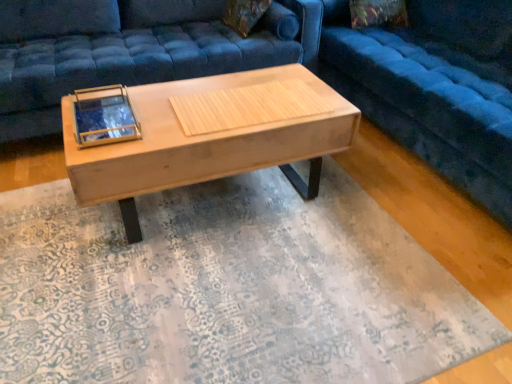
This screenshot has height=384, width=512. Describe the element at coordinates (434, 87) in the screenshot. I see `velvet blue studio couch at center, acting as the 1th studio couch starting from the right` at that location.

How much space does velvet blue studio couch at center, which is the 2th studio couch in left-to-right order, occupy vertically?

velvet blue studio couch at center, which is the 2th studio couch in left-to-right order, is 35.09 inches in height.

At what (x,y) coordinates should I click in order to perform the action: click on velvet blue studio couch at center, arranged as the first studio couch when viewed from the left. Please return your answer as a coordinate pair (x, y). Looking at the image, I should click on (142, 53).

From a real-world perspective, is velvet blue studio couch at center, which is the 2th studio couch in left-to-right order, physically located above or below natural wood coffee table at center?

From a real-world perspective, velvet blue studio couch at center, which is the 2th studio couch in left-to-right order, is physically above natural wood coffee table at center.

There is a natural wood coffee table at center. In order to click on the 2nd studio couch above it (from a real-world perspective) in this screenshot , I will do `click(434, 87)`.

Considering the relative sizes of velvet blue studio couch at center, acting as the 1th studio couch starting from the right, and natural wood coffee table at center in the image provided, is velvet blue studio couch at center, acting as the 1th studio couch starting from the right, bigger than natural wood coffee table at center?

Yes.

How distant is velvet blue studio couch at center, which is the 2th studio couch in left-to-right order, from natural wood coffee table at center?

velvet blue studio couch at center, which is the 2th studio couch in left-to-right order, and natural wood coffee table at center are 79.38 centimeters apart from each other.

Consider the image. Considering the sizes of objects velvet blue studio couch at center, the second studio couch viewed from the right, and natural wood coffee table at center in the image provided, who is smaller, velvet blue studio couch at center, the second studio couch viewed from the right, or natural wood coffee table at center?

natural wood coffee table at center is smaller.

Considering the points (225, 51) and (293, 127), which point is behind, point (225, 51) or point (293, 127)?

Point (225, 51)

Based on the photo, from the image's perspective, between velvet blue studio couch at center, the second studio couch viewed from the right, and natural wood coffee table at center, which one is located above?

velvet blue studio couch at center, the second studio couch viewed from the right, from the image's perspective.

Considering the relative sizes of natural wood coffee table at center and velvet blue studio couch at center, acting as the 1th studio couch starting from the right, in the image provided, is natural wood coffee table at center thinner than velvet blue studio couch at center, acting as the 1th studio couch starting from the right,?

Yes.

From the image's perspective, who appears lower, natural wood coffee table at center or velvet blue studio couch at center, acting as the 1th studio couch starting from the right?

natural wood coffee table at center, from the image's perspective.

In the scene shown: Is natural wood coffee table at center at the right side of velvet blue studio couch at center, which is the 2th studio couch in left-to-right order?

No.

Could you tell me if natural wood coffee table at center is turned towards velvet blue studio couch at center, acting as the 1th studio couch starting from the right?

No, natural wood coffee table at center is not facing towards velvet blue studio couch at center, acting as the 1th studio couch starting from the right.

Could you tell me if velvet blue studio couch at center, arranged as the first studio couch when viewed from the left, is facing velvet blue studio couch at center, acting as the 1th studio couch starting from the right?

No, velvet blue studio couch at center, arranged as the first studio couch when viewed from the left, is not oriented towards velvet blue studio couch at center, acting as the 1th studio couch starting from the right.

Is velvet blue studio couch at center, the second studio couch viewed from the right, far from velvet blue studio couch at center, acting as the 1th studio couch starting from the right?

No, velvet blue studio couch at center, the second studio couch viewed from the right, is not far away from velvet blue studio couch at center, acting as the 1th studio couch starting from the right.

Is velvet blue studio couch at center, the second studio couch viewed from the right, shorter than velvet blue studio couch at center, acting as the 1th studio couch starting from the right?

Indeed, velvet blue studio couch at center, the second studio couch viewed from the right, has a lesser height compared to velvet blue studio couch at center, acting as the 1th studio couch starting from the right.

Is velvet blue studio couch at center, the second studio couch viewed from the right, at the left side of velvet blue studio couch at center, which is the 2th studio couch in left-to-right order?

Correct, you'll find velvet blue studio couch at center, the second studio couch viewed from the right, to the left of velvet blue studio couch at center, which is the 2th studio couch in left-to-right order.

Considering the positions of points (215, 129) and (192, 49), is point (215, 129) farther from camera compared to point (192, 49)?

No, it is not.

Could you measure the distance between natural wood coffee table at center and velvet blue studio couch at center, the second studio couch viewed from the right?

natural wood coffee table at center and velvet blue studio couch at center, the second studio couch viewed from the right, are 23.38 inches apart from each other.

Are natural wood coffee table at center and velvet blue studio couch at center, the second studio couch viewed from the right, located far from each other?

No, natural wood coffee table at center is not far from velvet blue studio couch at center, the second studio couch viewed from the right.

Between point (474, 81) and point (4, 103), which one is positioned in front?

The point (474, 81) is closer to the camera.

Does velvet blue studio couch at center, which is the 2th studio couch in left-to-right order, lie in front of velvet blue studio couch at center, the second studio couch viewed from the right?

Yes, velvet blue studio couch at center, which is the 2th studio couch in left-to-right order, is closer to the camera.

Is velvet blue studio couch at center, which is the 2th studio couch in left-to-right order, shorter than velvet blue studio couch at center, arranged as the first studio couch when viewed from the left?

Incorrect, the height of velvet blue studio couch at center, which is the 2th studio couch in left-to-right order, does not fall short of that of velvet blue studio couch at center, arranged as the first studio couch when viewed from the left.

Can velvet blue studio couch at center, arranged as the first studio couch when viewed from the left, be found inside velvet blue studio couch at center, acting as the 1th studio couch starting from the right?

No, velvet blue studio couch at center, arranged as the first studio couch when viewed from the left, is located outside of velvet blue studio couch at center, acting as the 1th studio couch starting from the right.

Locate an element on the screen. studio couch that is in front of the natural wood coffee table at center is located at coordinates (434, 87).

What are the coordinates of `coffee table beneath the velvet blue studio couch at center, arranged as the first studio couch when viewed from the left (from a real-world perspective)` in the screenshot? It's located at (212, 135).

From the image, which object appears to be farther from velvet blue studio couch at center, acting as the 1th studio couch starting from the right, velvet blue studio couch at center, the second studio couch viewed from the right, or natural wood coffee table at center?

Based on the image, velvet blue studio couch at center, the second studio couch viewed from the right, appears to be further to velvet blue studio couch at center, acting as the 1th studio couch starting from the right.

Based on their spatial positions, is velvet blue studio couch at center, which is the 2th studio couch in left-to-right order, or velvet blue studio couch at center, arranged as the first studio couch when viewed from the left, closer to natural wood coffee table at center?

The object closer to natural wood coffee table at center is velvet blue studio couch at center, arranged as the first studio couch when viewed from the left.

When comparing their distances from natural wood coffee table at center, does velvet blue studio couch at center, the second studio couch viewed from the right, or velvet blue studio couch at center, which is the 2th studio couch in left-to-right order, seem further?

velvet blue studio couch at center, which is the 2th studio couch in left-to-right order, is positioned further to the anchor natural wood coffee table at center.

In the scene shown: Which object lies further to the anchor point velvet blue studio couch at center, the second studio couch viewed from the right, natural wood coffee table at center or velvet blue studio couch at center, acting as the 1th studio couch starting from the right?

velvet blue studio couch at center, acting as the 1th studio couch starting from the right, lies further to velvet blue studio couch at center, the second studio couch viewed from the right, than the other object.

Considering their positions, is velvet blue studio couch at center, which is the 2th studio couch in left-to-right order, positioned further to velvet blue studio couch at center, arranged as the first studio couch when viewed from the left, than natural wood coffee table at center?

velvet blue studio couch at center, which is the 2th studio couch in left-to-right order.

Which object lies nearer to the anchor point velvet blue studio couch at center, acting as the 1th studio couch starting from the right, natural wood coffee table at center or velvet blue studio couch at center, arranged as the first studio couch when viewed from the left?

natural wood coffee table at center.

Where is `coffee table between velvet blue studio couch at center, arranged as the first studio couch when viewed from the left, and velvet blue studio couch at center, acting as the 1th studio couch starting from the right, in the horizontal direction`? This screenshot has width=512, height=384. coffee table between velvet blue studio couch at center, arranged as the first studio couch when viewed from the left, and velvet blue studio couch at center, acting as the 1th studio couch starting from the right, in the horizontal direction is located at coordinates (212, 135).